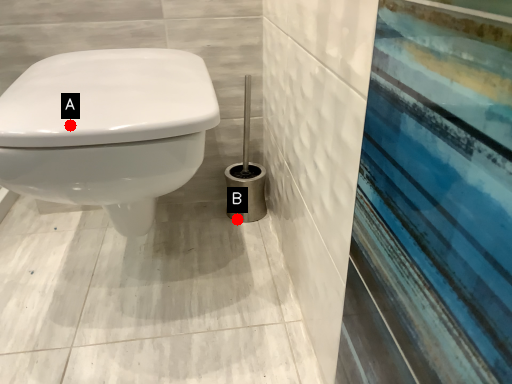
Question: Two points are circled on the image, labeled by A and B beside each circle. Which point is closer to the camera taking this photo?

Choices:
 (A) A is closer
 (B) B is closer

Answer: (A)